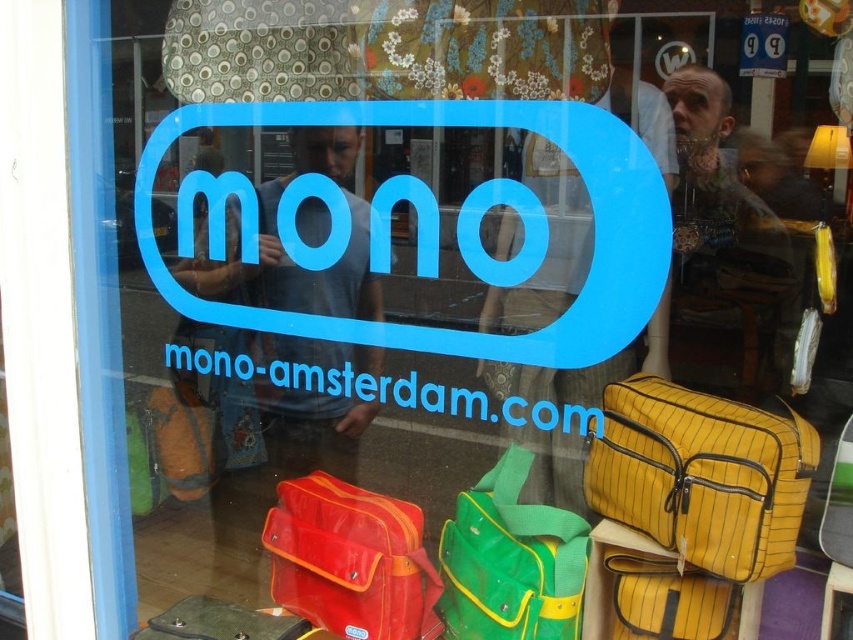
Question: Considering the real-world distances, which object is farthest from the green fabric bag at center?

Choices:
 (A) matte black bag at lower left
 (B) matte red bag at center
 (C) yellow striped fabric bag at lower right
 (D) yellow striped bag at center

Answer: (A)

Question: Estimate the real-world distances between objects in this image. Which object is farther from the green fabric bag at center?

Choices:
 (A) matte red bag at center
 (B) yellow striped bag at center
 (C) yellow striped fabric bag at lower right

Answer: (C)

Question: Is green fabric bag at center to the right of yellow striped bag at center from the viewer's perspective?

Choices:
 (A) yes
 (B) no

Answer: (B)

Question: Is yellow striped fabric bag at lower right smaller than matte black bag at lower left?

Choices:
 (A) yes
 (B) no

Answer: (B)

Question: Among these objects, which one is farthest from the camera?

Choices:
 (A) matte black bag at lower left
 (B) yellow striped bag at center
 (C) matte red bag at center

Answer: (A)

Question: Can you confirm if green fabric bag at center is bigger than matte black bag at lower left?

Choices:
 (A) yes
 (B) no

Answer: (A)